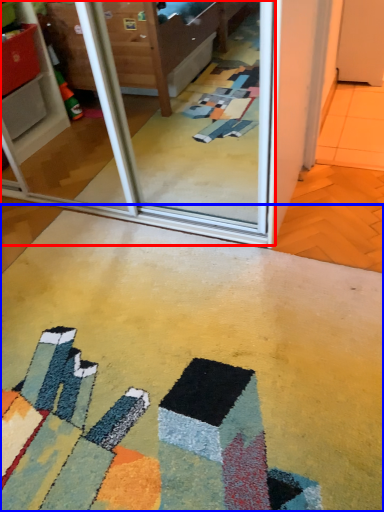
Question: Which of the following is the closest to the observer, screen door (highlighted by a red box) or concrete (highlighted by a blue box)?

Choices:
 (A) screen door
 (B) concrete

Answer: (B)